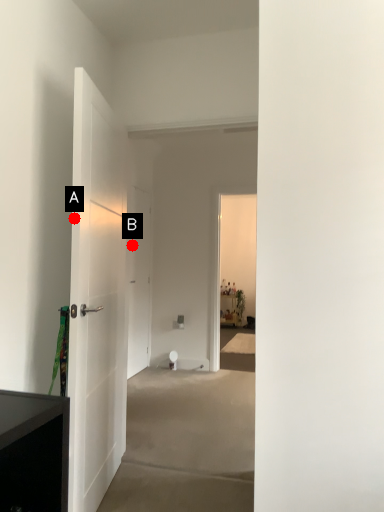
Question: Two points are circled on the image, labeled by A and B beside each circle. Which point is farther to the camera?

Choices:
 (A) A is further
 (B) B is further

Answer: (B)